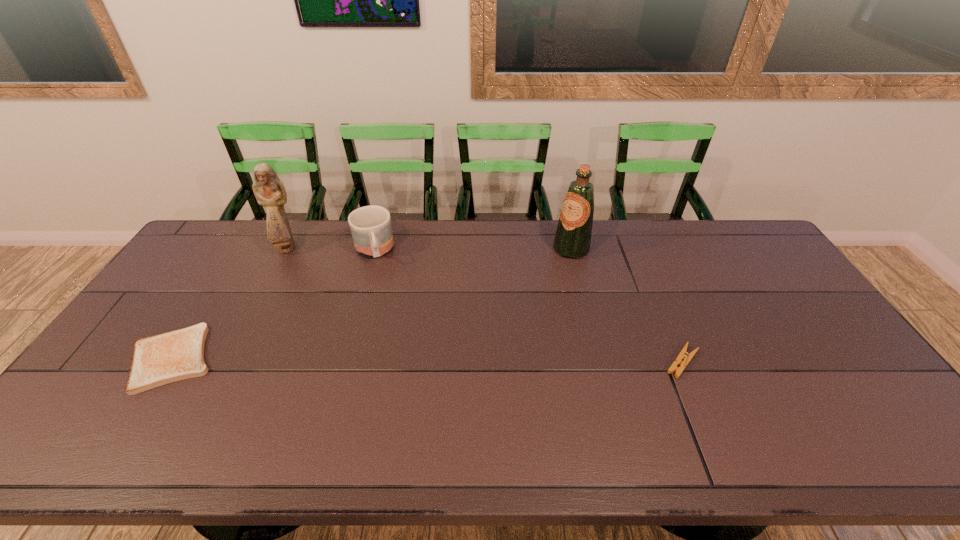
Find the location of `vacant space located 0.250m on the front-facing side of the olive oil`. vacant space located 0.250m on the front-facing side of the olive oil is located at coordinates click(522, 300).

Locate an element on the screen. This screenshot has height=540, width=960. vacant space situated 0.080m on the front-facing side of the figurine is located at coordinates (302, 267).

Locate an element on the screen. The image size is (960, 540). free location located on the front-facing side of the figurine is located at coordinates (300, 265).

Where is `vacant space located on the front-facing side of the figurine`? Image resolution: width=960 pixels, height=540 pixels. vacant space located on the front-facing side of the figurine is located at coordinates (310, 275).

Identify the location of free space located on the side with the handle of the third object from right to left. Image resolution: width=960 pixels, height=540 pixels. (388, 329).

Where is `vacant space located 0.360m on the side with the handle of the third object from right to left`? vacant space located 0.360m on the side with the handle of the third object from right to left is located at coordinates (393, 350).

This screenshot has height=540, width=960. In order to click on vacant point located on the side with the handle of the third object from right to left in this screenshot , I will do `click(390, 334)`.

Image resolution: width=960 pixels, height=540 pixels. Find the location of `olive oil positioned at the far edge`. olive oil positioned at the far edge is located at coordinates (572, 239).

Identify the location of figurine that is positioned at the far edge. The width and height of the screenshot is (960, 540). (268, 189).

Identify the location of mug present at the far edge. The height and width of the screenshot is (540, 960). (371, 229).